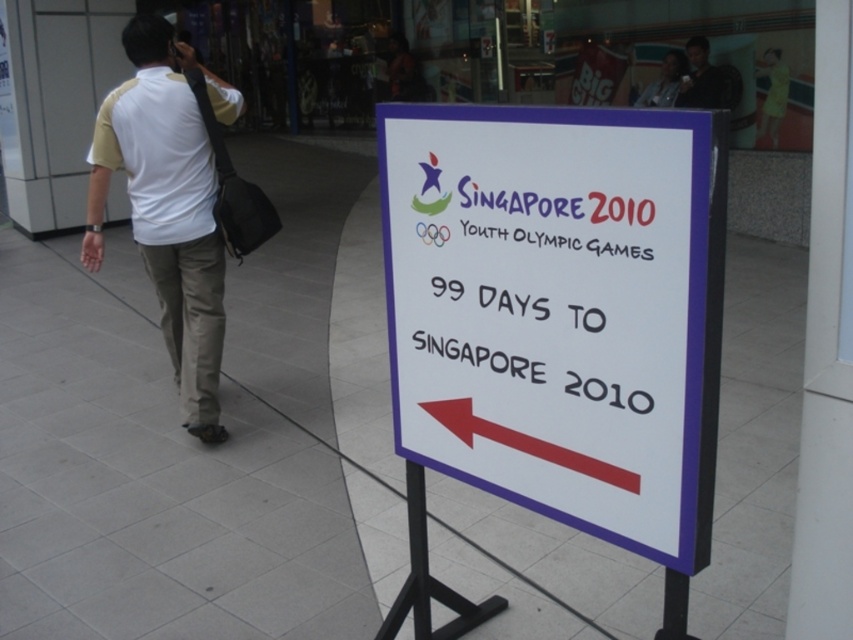
Question: Can you confirm if white paper sign at center is positioned above white cotton shirt at left?

Choices:
 (A) yes
 (B) no

Answer: (B)

Question: Which of these objects is positioned farthest from the white paper sign at center?

Choices:
 (A) white tile pavement at center
 (B) white cotton shirt at left
 (C) red plastic arrow at lower center

Answer: (B)

Question: Is white tile pavement at center thinner than white cotton shirt at left?

Choices:
 (A) no
 (B) yes

Answer: (B)

Question: Estimate the real-world distances between objects in this image. Which object is farther from the white tile pavement at center?

Choices:
 (A) red plastic arrow at lower center
 (B) white paper sign at center
 (C) white cotton shirt at left

Answer: (C)

Question: Is white tile pavement at center positioned before white paper sign at center?

Choices:
 (A) yes
 (B) no

Answer: (B)

Question: Based on their relative distances, which object is farther from the white tile pavement at center?

Choices:
 (A) white paper sign at center
 (B) white cotton shirt at left

Answer: (B)